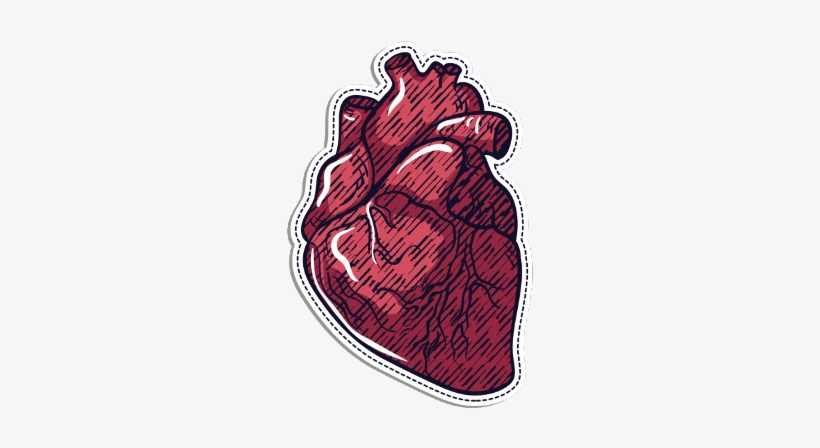
The width and height of the screenshot is (820, 448). What are the coordinates of `sticker edge` in the screenshot? It's located at (289, 235), (303, 185), (330, 114).